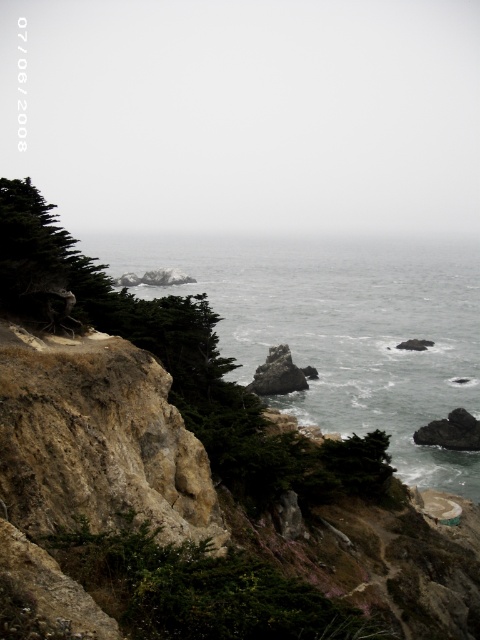
Question: Does gray/rocky water at center appear over dark gray rock at center right?

Choices:
 (A) yes
 (B) no

Answer: (A)

Question: Based on their relative distances, which object is nearer to the gray/rocky water at center?

Choices:
 (A) rusty rock at center
 (B) dark gray rock at center right

Answer: (B)

Question: Among these points, which one is nearest to the camera?

Choices:
 (A) (465, 436)
 (B) (315, 252)

Answer: (A)

Question: Does dark gray rock at center right have a lesser width compared to rusty rock at center?

Choices:
 (A) yes
 (B) no

Answer: (B)

Question: Which object is farther from the camera taking this photo?

Choices:
 (A) dark gray rock at center right
 (B) gray/rocky water at center

Answer: (A)

Question: Does gray/rocky water at center come behind rusty rock at center?

Choices:
 (A) yes
 (B) no

Answer: (B)